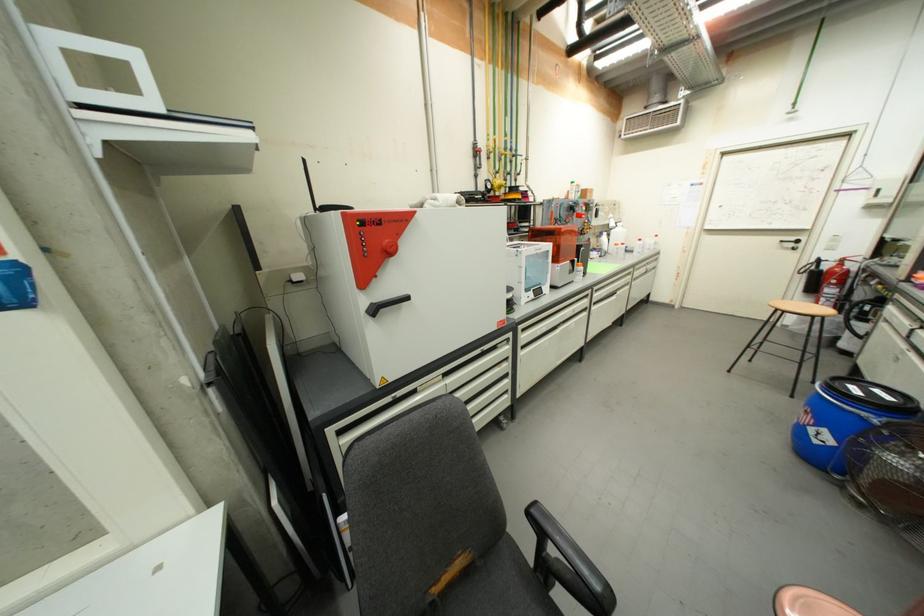
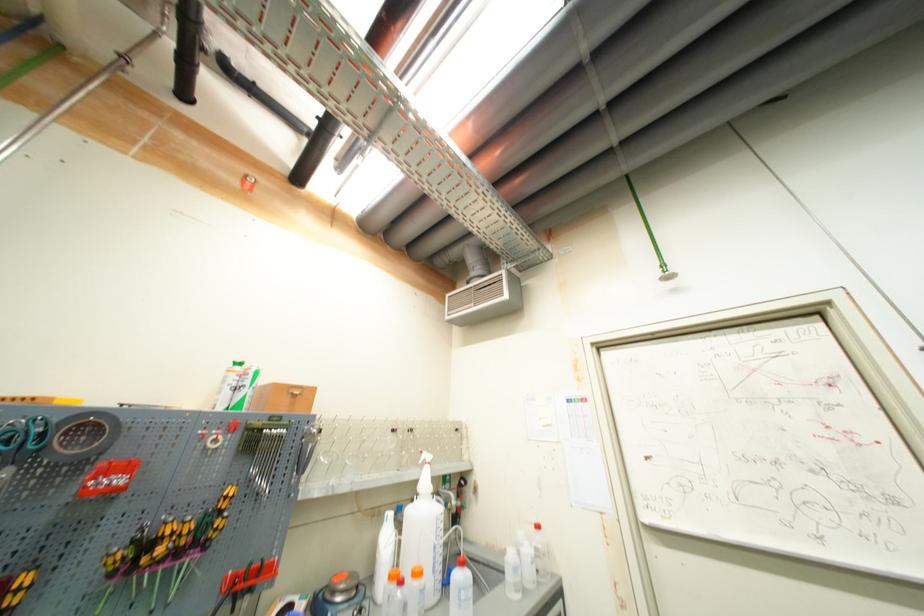
Locate, in the second image, the point that corresponds to pixel 563 74 in the first image.

(253, 185)